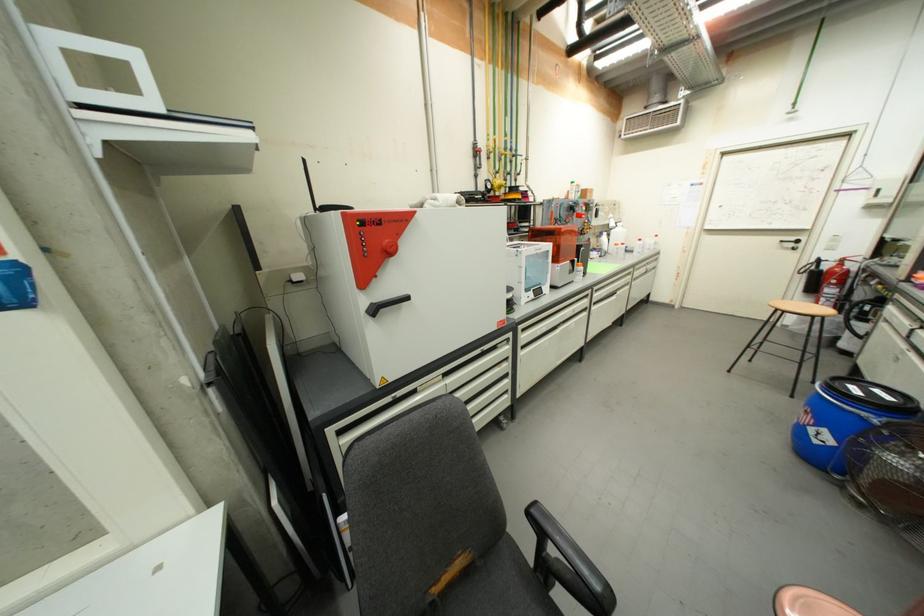
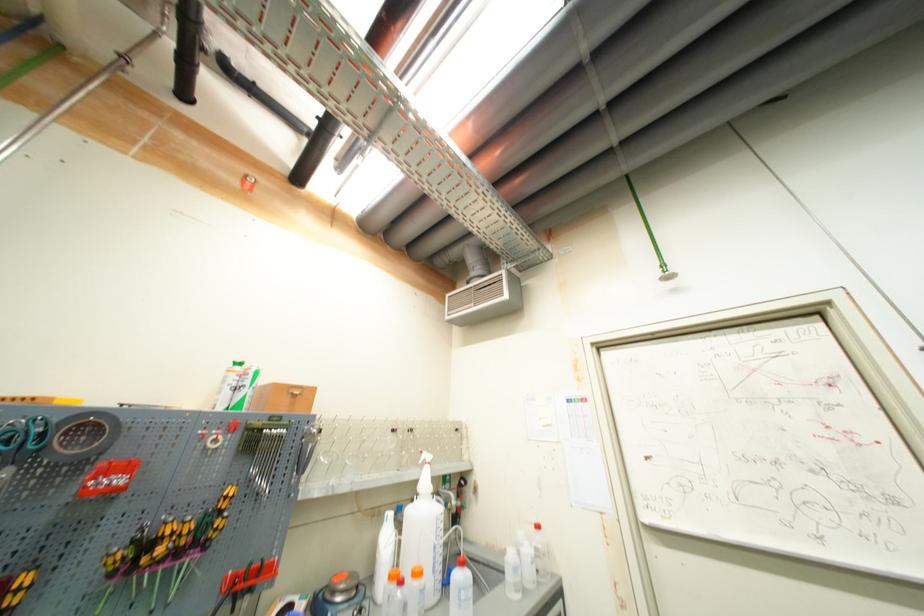
Locate, in the second image, the point that corresponds to pixel 563 74 in the first image.

(253, 185)